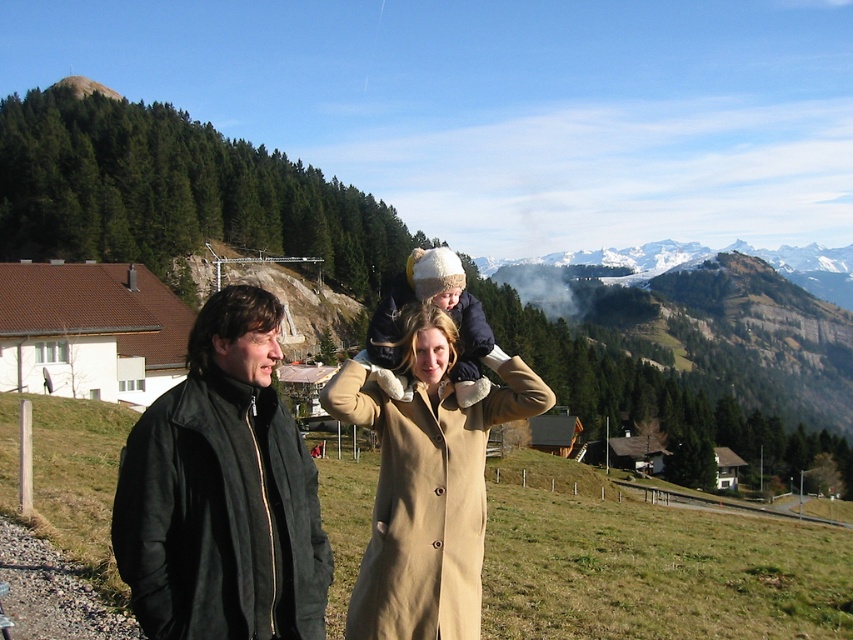
Question: Among these objects, which one is farthest from the camera?

Choices:
 (A) beige woolen coat at center
 (B) black leather jacket at left
 (C) white knit hat at center

Answer: (C)

Question: Is black leather jacket at left positioned at the back of white knit hat at center?

Choices:
 (A) yes
 (B) no

Answer: (B)

Question: Can you confirm if beige woolen coat at center is positioned to the left of white knit hat at center?

Choices:
 (A) yes
 (B) no

Answer: (A)

Question: Which object is closer to the camera taking this photo?

Choices:
 (A) black leather jacket at left
 (B) white knit hat at center

Answer: (A)

Question: Can you confirm if black leather jacket at left is thinner than white knit hat at center?

Choices:
 (A) no
 (B) yes

Answer: (A)

Question: Which point is farther from the camera taking this photo?

Choices:
 (A) (276, 515)
 (B) (415, 534)
 (C) (450, 307)

Answer: (C)